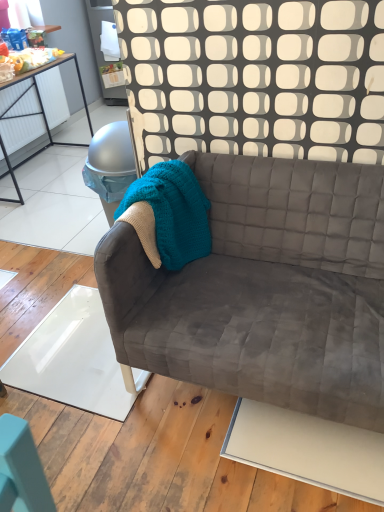
Question: Is point (332, 225) positioned closer to the camera than point (127, 211)?

Choices:
 (A) farther
 (B) closer

Answer: (A)

Question: Is velvet gray couch at center in front of or behind teal knitted blanket at center in the image?

Choices:
 (A) behind
 (B) front

Answer: (B)

Question: From a real-world perspective, is velvet gray couch at center above or below teal knitted blanket at center?

Choices:
 (A) above
 (B) below

Answer: (B)

Question: Would you say teal knitted blanket at center is to the left or to the right of velvet gray couch at center in the picture?

Choices:
 (A) right
 (B) left

Answer: (B)

Question: From a real-world perspective, relative to velvet gray couch at center, is teal knitted blanket at center vertically above or below?

Choices:
 (A) above
 (B) below

Answer: (A)

Question: Looking at their shapes, would you say teal knitted blanket at center is wider or thinner than velvet gray couch at center?

Choices:
 (A) wide
 (B) thin

Answer: (B)

Question: Considering the positions of teal knitted blanket at center and velvet gray couch at center in the image, is teal knitted blanket at center taller or shorter than velvet gray couch at center?

Choices:
 (A) tall
 (B) short

Answer: (B)